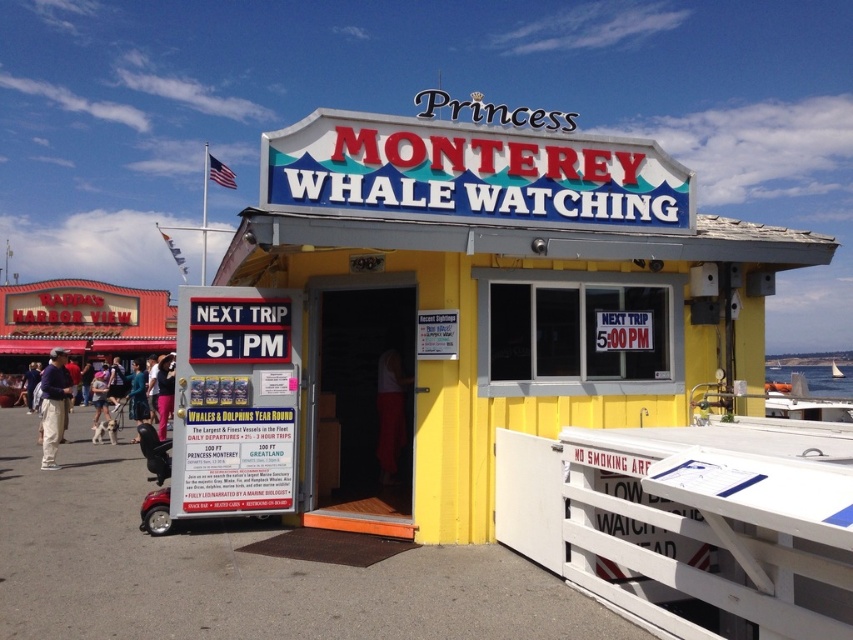
You are standing in front of the Princess Monterey Whale Watching building. You see a yellow woodshed at center and a light brown leather jacket at lower left. Which object is taller?

The yellow woodshed at center is much taller than the light brown leather jacket at lower left.

You are standing at the entrance of the Princess Monterey Whale Watching building and see the white painted wood dock at lower right and the pink fabric pants at lower left. Which object is located to the right side of the other?

The white painted wood dock at lower right is positioned on the right side of pink fabric pants at lower left.